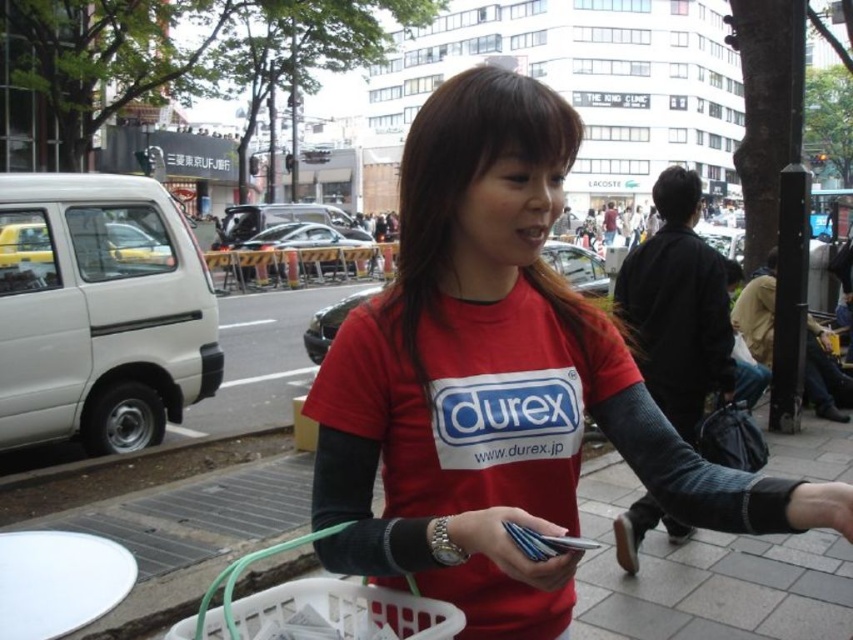
Question: Which point appears farthest from the camera in this image?

Choices:
 (A) (610, 460)
 (B) (590, 328)

Answer: (A)

Question: Where is white plastic basket at center located in relation to white plastic basket at lower center in the image?

Choices:
 (A) right
 (B) left

Answer: (B)

Question: Which object is the closest to the metallic silver cards at center?

Choices:
 (A) white plastic basket at lower center
 (B) white plastic basket at center

Answer: (A)

Question: Is white plastic basket at center thinner than matte red t-shirt at center?

Choices:
 (A) no
 (B) yes

Answer: (A)

Question: Is white plastic basket at center positioned at the back of metallic silver cards at center?

Choices:
 (A) no
 (B) yes

Answer: (B)

Question: Which is nearer to the red matte t-shirt at center?

Choices:
 (A) white plastic basket at lower center
 (B) matte red t-shirt at center

Answer: (A)